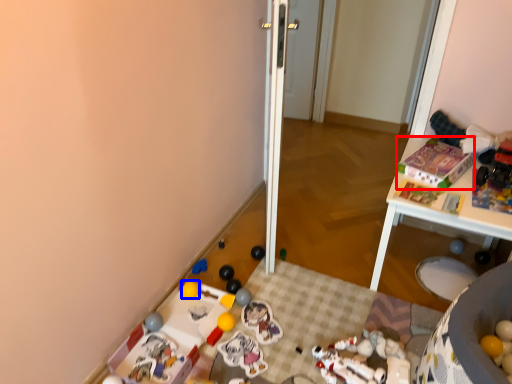
Question: Which object is further to the camera taking this photo, toy (highlighted by a red box) or toy (highlighted by a blue box)?

Choices:
 (A) toy
 (B) toy

Answer: (B)